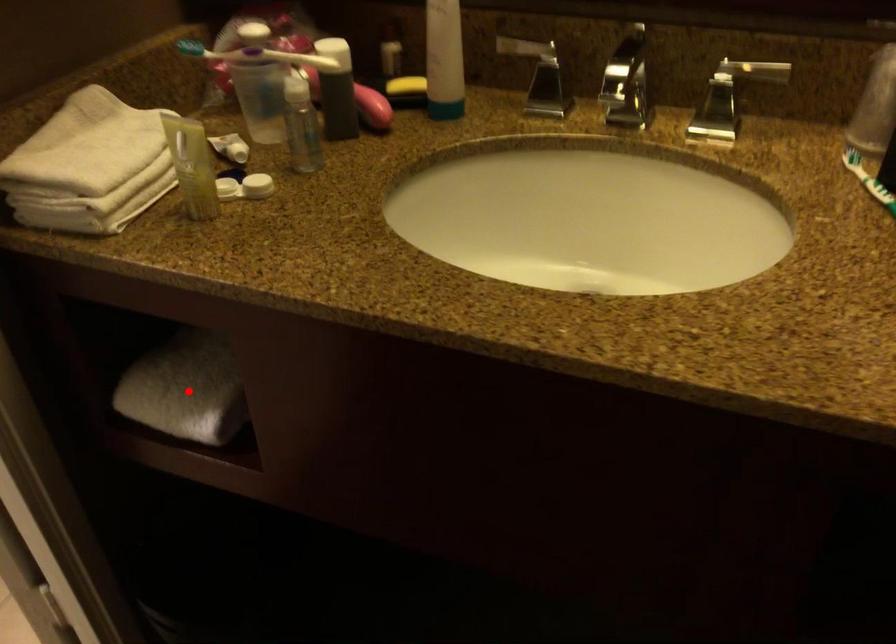
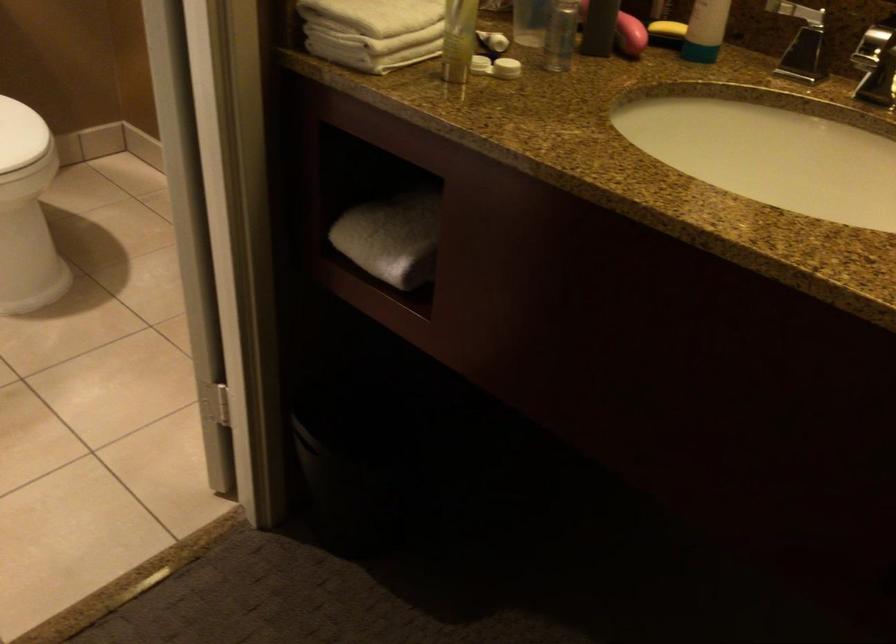
Question: I am providing you with two images of the same scene from different viewpoints. A red point is shown in image1. For the corresponding object point in image2, is it positioned nearer or farther from the camera?

Choices:
 (A) Nearer
 (B) Farther

Answer: (B)